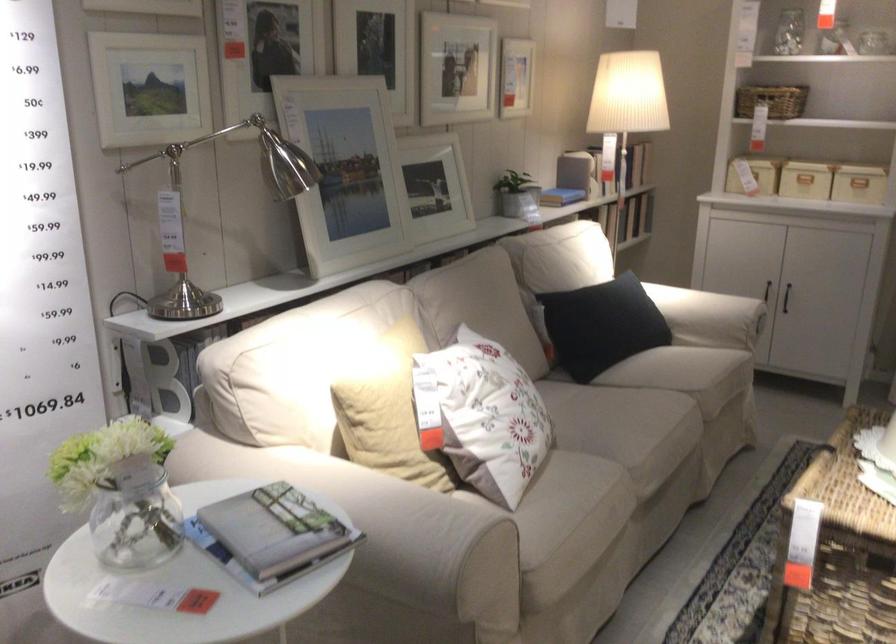
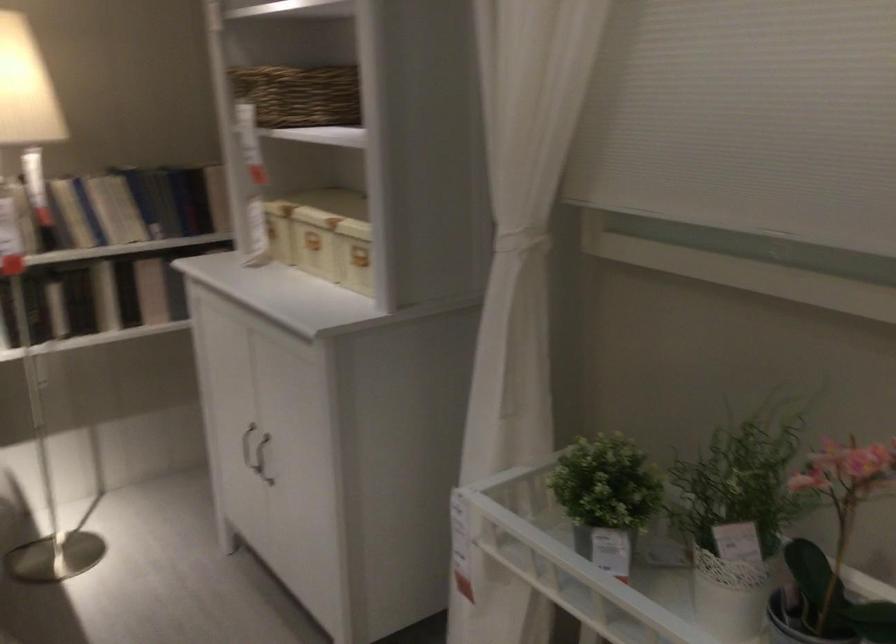
The point at (605, 218) is marked in the first image. Where is the corresponding point in the second image?

(55, 307)